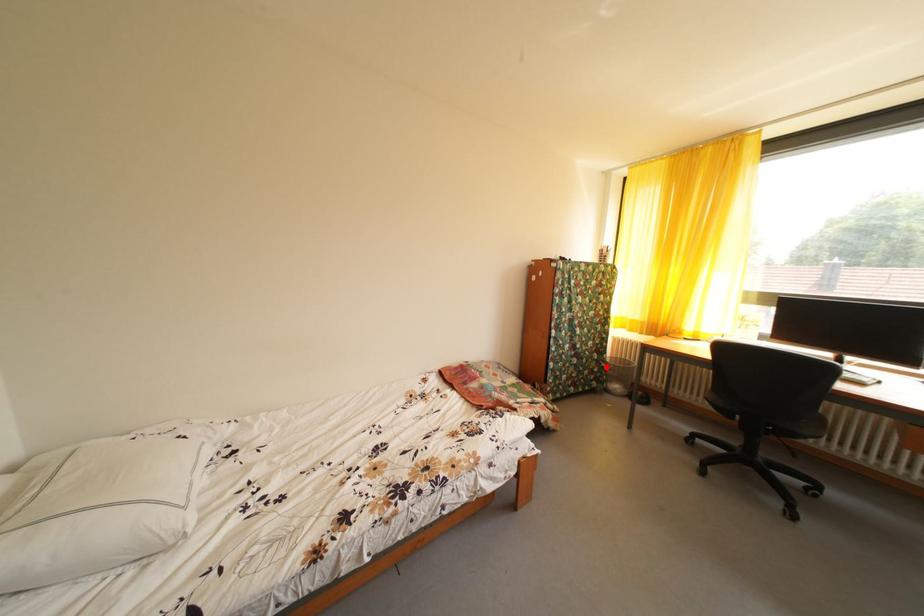
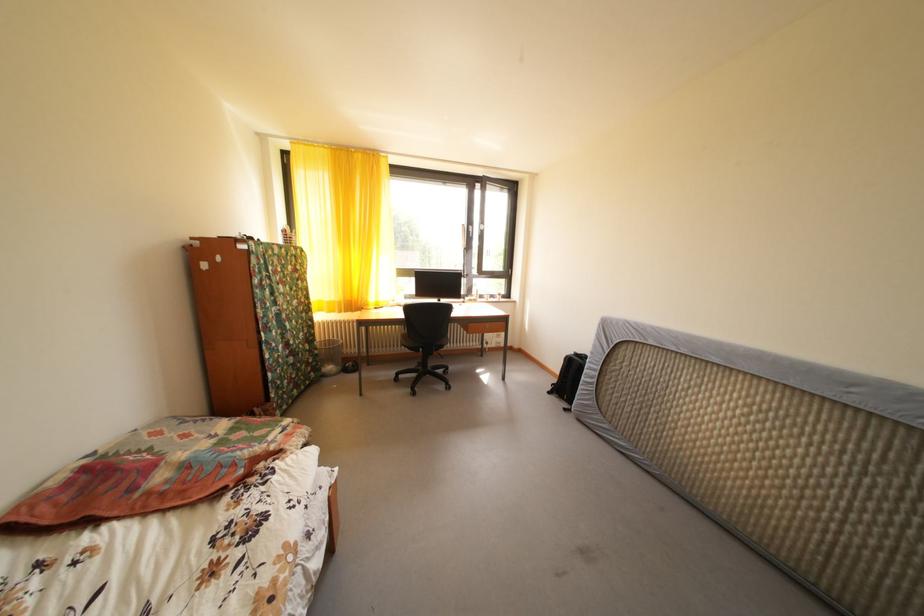
Question: A red point is marked in image1. In image2, is the corresponding 3D point closer to the camera or farther? Reply with the corresponding letter.

Choices:
 (A) The corresponding 3D point is closer.
 (B) The corresponding 3D point is farther.

Answer: (A)